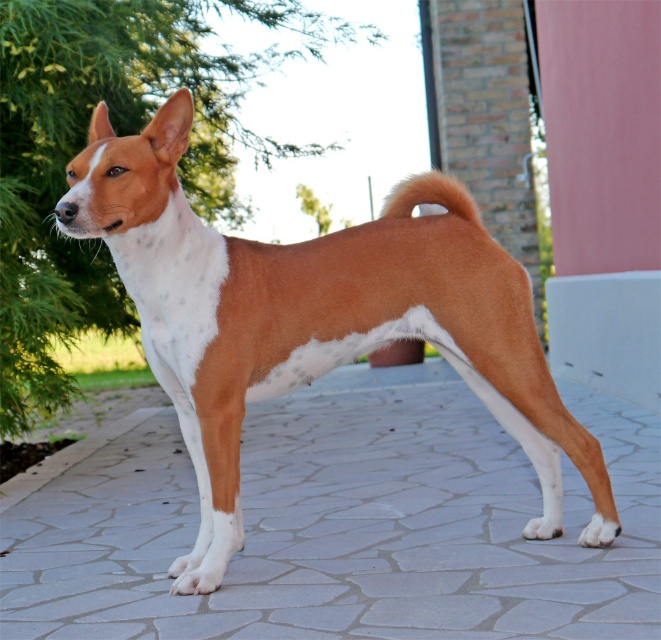
You are a drone operator trying to land a drone on the gray stone pavement at center. The drone has a GPS that can only target coordinates with two decimal places. What coordinates should you input to land the drone as close as possible?

The gray stone pavement at center is located at point (344, 524). To land the drone as close as possible, you should input coordinates rounded to two decimal places, which would be 0.82 and 0.52.